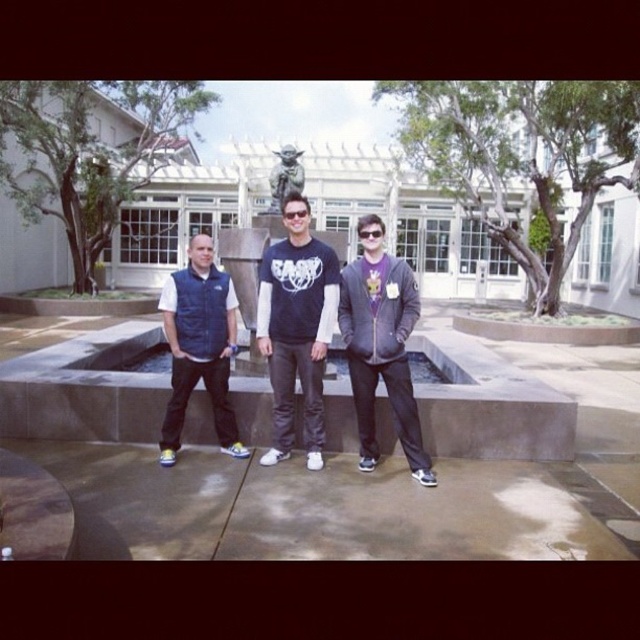
Question: From the image, what is the correct spatial relationship of matte black t-shirt at center in relation to navy blue vest at center?

Choices:
 (A) right
 (B) left

Answer: (A)

Question: Which object appears farthest from the camera in this image?

Choices:
 (A) matte black t-shirt at center
 (B) matte gray hoodie at center
 (C) navy blue vest at center

Answer: (C)

Question: Which of the following is the closest to the observer?

Choices:
 (A) navy blue vest at center
 (B) matte gray hoodie at center

Answer: (B)

Question: Is matte black t-shirt at center closer to the viewer compared to matte black goggles at center?

Choices:
 (A) yes
 (B) no

Answer: (B)

Question: Is matte black t-shirt at center to the right of navy blue vest at center from the viewer's perspective?

Choices:
 (A) no
 (B) yes

Answer: (B)

Question: Which point is closer to the camera?

Choices:
 (A) matte black t-shirt at center
 (B) navy blue vest at center
 (C) matte black goggles at center
 (D) matte gray hoodie at center

Answer: (D)